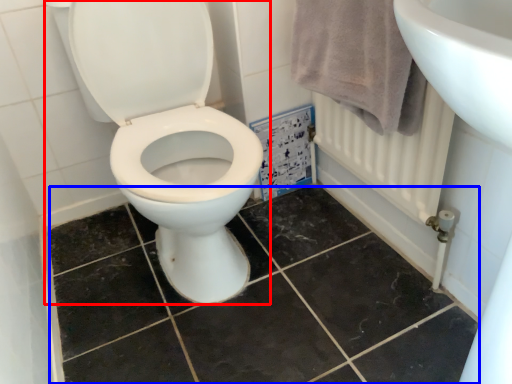
Question: Among these objects, which one is nearest to the camera, toilet (highlighted by a red box) or ceramic tile (highlighted by a blue box)?

Choices:
 (A) toilet
 (B) ceramic tile

Answer: (A)